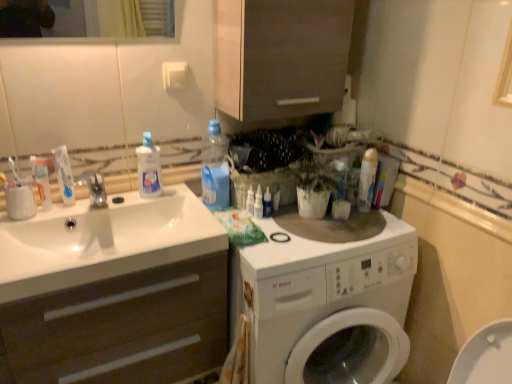
Where is `free spot in front of transparent plastic spray bottle at center, the 2th cleaning product when ordered from right to left`? The width and height of the screenshot is (512, 384). free spot in front of transparent plastic spray bottle at center, the 2th cleaning product when ordered from right to left is located at coordinates (276, 253).